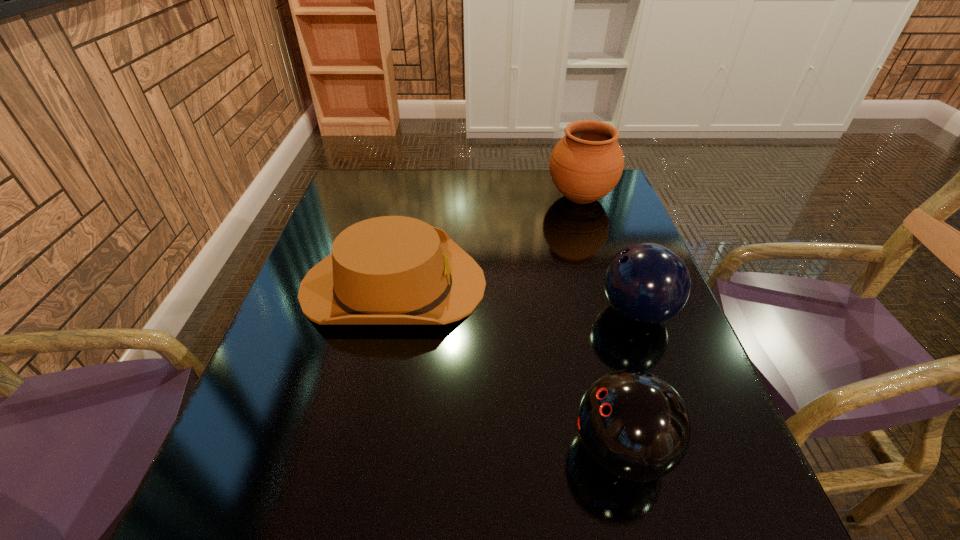
Locate an element on the screen. free space located 0.340m on the surface of the nearer bowling ball near the finger holes is located at coordinates (370, 449).

At what (x,y) coordinates should I click in order to perform the action: click on vacant space located on the surface of the nearer bowling ball near the finger holes. Please return your answer as a coordinate pair (x, y). This screenshot has height=540, width=960. Looking at the image, I should click on (381, 449).

I want to click on free space located 0.090m on the surface of the nearer bowling ball near the finger holes, so click(518, 449).

I want to click on vacant position located on the front-facing side of the leftmost object, so click(x=592, y=285).

Identify the location of object present at the far edge. This screenshot has height=540, width=960. (586, 164).

You are a GUI agent. You are given a task and a screenshot of the screen. Output one action in this format:
    pyautogui.click(x=<x>, y=<y>)
    Task: Click on the object that is at the near edge
    This screenshot has width=960, height=540.
    Given the screenshot: What is the action you would take?
    pyautogui.click(x=634, y=425)

Where is `object that is at the left edge`? object that is at the left edge is located at coordinates (391, 270).

Identify the location of pottery situated at the right edge. Image resolution: width=960 pixels, height=540 pixels. (586, 164).

The height and width of the screenshot is (540, 960). Find the location of `object present at the far right corner`. object present at the far right corner is located at coordinates (586, 164).

Where is `object that is at the near right corner`? This screenshot has width=960, height=540. object that is at the near right corner is located at coordinates (634, 425).